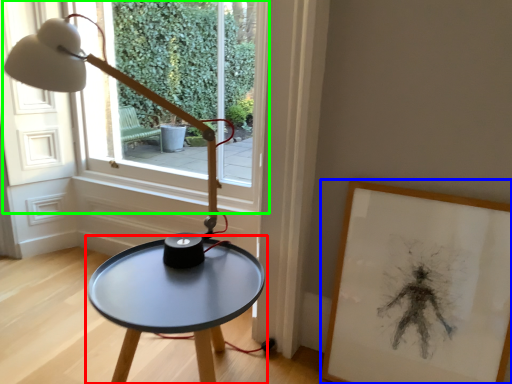
Question: Which object is positioned farthest from table (highlighted by a red box)? Select from picture frame (highlighted by a blue box) and window (highlighted by a green box).

Choices:
 (A) picture frame
 (B) window

Answer: (B)